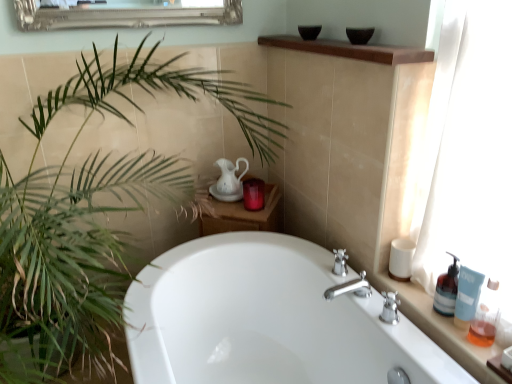
Question: Considering the relative sizes of white matte cup at right, positioned as the second toiletry in bottom-to-top order, and translucent glass soap dispenser at right, the second soap dispenser positioned from the front, in the image provided, is white matte cup at right, positioned as the second toiletry in bottom-to-top order, wider than translucent glass soap dispenser at right, the second soap dispenser positioned from the front,?

Choices:
 (A) no
 (B) yes

Answer: (B)

Question: From a real-world perspective, is white matte cup at right, which is the second toiletry in back-to-front order, beneath translucent glass soap dispenser at right, the first soap dispenser positioned from the back?

Choices:
 (A) no
 (B) yes

Answer: (B)

Question: From the image's perspective, does white matte cup at right, positioned as the second toiletry in bottom-to-top order, appear lower than translucent glass soap dispenser at right, the second soap dispenser positioned from the front?

Choices:
 (A) no
 (B) yes

Answer: (A)

Question: Does white matte cup at right, which is the 2th toiletry in front-to-back order, have a lesser height compared to translucent glass soap dispenser at right, the second soap dispenser positioned from the front?

Choices:
 (A) no
 (B) yes

Answer: (B)

Question: From a real-world perspective, is white matte cup at right, which is the second toiletry in back-to-front order, located higher than translucent glass soap dispenser at right, the first soap dispenser positioned from the back?

Choices:
 (A) yes
 (B) no

Answer: (B)

Question: Based on their positions, is translucent glass soap dispenser at right, the second soap dispenser positioned from the front, located to the left or right of translucent plastic soap dispenser at right, which is the 1th soap dispenser in front-to-back order?

Choices:
 (A) right
 (B) left

Answer: (B)

Question: Considering the positions of translucent glass soap dispenser at right, the second soap dispenser positioned from the front, and translucent plastic soap dispenser at right, positioned as the second soap dispenser in back-to-front order, in the image, is translucent glass soap dispenser at right, the second soap dispenser positioned from the front, bigger or smaller than translucent plastic soap dispenser at right, positioned as the second soap dispenser in back-to-front order,?

Choices:
 (A) small
 (B) big

Answer: (A)

Question: From a real-world perspective, is translucent glass soap dispenser at right, the first soap dispenser positioned from the back, above or below translucent plastic soap dispenser at right, positioned as the second soap dispenser in back-to-front order?

Choices:
 (A) above
 (B) below

Answer: (B)

Question: In the image, is translucent glass soap dispenser at right, the second soap dispenser positioned from the front, positioned in front of or behind translucent plastic soap dispenser at right, positioned as the second soap dispenser in back-to-front order?

Choices:
 (A) behind
 (B) front

Answer: (A)

Question: In terms of size, does blue matte tube at right, the third toiletry from the back, appear bigger or smaller than green leafy plant at left?

Choices:
 (A) big
 (B) small

Answer: (B)

Question: From the image's perspective, relative to green leafy plant at left, is blue matte tube at right, the third toiletry from the back, above or below?

Choices:
 (A) below
 (B) above

Answer: (A)

Question: From a real-world perspective, is blue matte tube at right, which is counted as the 1th toiletry, starting from the front, above or below green leafy plant at left?

Choices:
 (A) above
 (B) below

Answer: (A)

Question: Visually, is blue matte tube at right, acting as the third toiletry starting from the top, positioned to the left or to the right of green leafy plant at left?

Choices:
 (A) left
 (B) right

Answer: (B)

Question: Based on their sizes in the image, would you say white glossy bathtub at center is bigger or smaller than translucent plastic bottles at right, the second counter top in the left-to-right sequence?

Choices:
 (A) big
 (B) small

Answer: (A)

Question: Would you say white glossy bathtub at center is to the left or to the right of translucent plastic bottles at right, which is the first counter top from right to left, in the picture?

Choices:
 (A) left
 (B) right

Answer: (A)